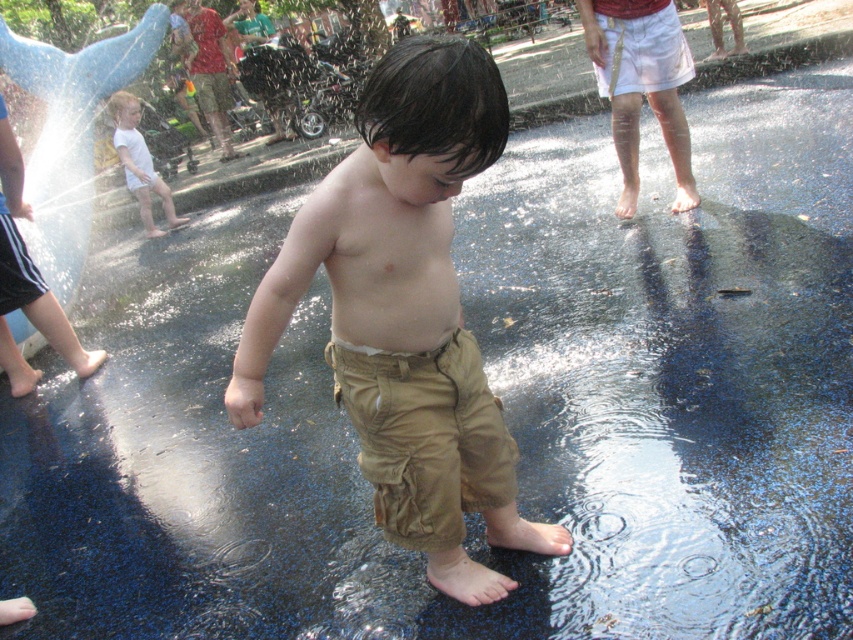
Question: Is khaki cotton pants at center below khaki pants at center?

Choices:
 (A) yes
 (B) no

Answer: (A)

Question: Is khaki cotton pants at center to the right of khaki pants at center from the viewer's perspective?

Choices:
 (A) no
 (B) yes

Answer: (A)

Question: Which of these objects is positioned farthest from the khaki cotton pants at center?

Choices:
 (A) khaki pants at center
 (B) white cotton shirt at left

Answer: (B)

Question: Which point is farther from the camera taking this photo?

Choices:
 (A) (113, 100)
 (B) (675, 26)
 (C) (248, 396)

Answer: (A)

Question: Is the position of khaki cotton pants at center less distant than that of white cotton shirt at left?

Choices:
 (A) no
 (B) yes

Answer: (B)

Question: Which point is closer to the camera?

Choices:
 (A) khaki pants at center
 (B) khaki cotton pants at center

Answer: (B)